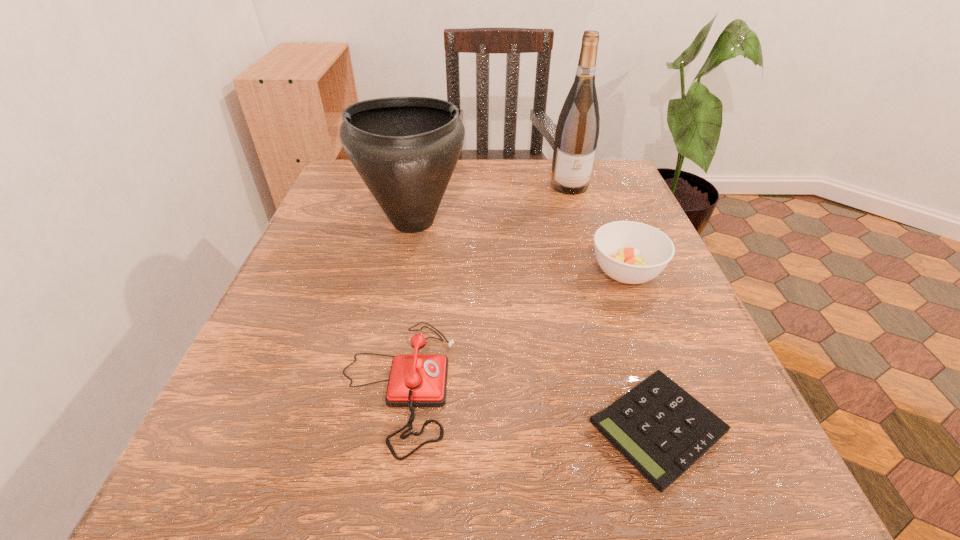
You are a GUI agent. You are given a task and a screenshot of the screen. Output one action in this format:
    pyautogui.click(x=<x>, y=<y>)
    Task: Click on the object that is positioned at the near left corner
    The image size is (960, 540).
    Given the screenshot: What is the action you would take?
    pyautogui.click(x=415, y=380)

Image resolution: width=960 pixels, height=540 pixels. I want to click on object at the far right corner, so click(x=577, y=131).

Image resolution: width=960 pixels, height=540 pixels. Identify the location of object that is at the near right corner. (662, 430).

Locate an element on the screen. free point at the far edge is located at coordinates (483, 205).

At what (x,y) coordinates should I click in order to perform the action: click on vacant space at the near edge of the desktop. Please return your answer as a coordinate pair (x, y). The image size is (960, 540). Looking at the image, I should click on 366,455.

This screenshot has height=540, width=960. In the image, there is a desktop. What are the coordinates of `vacant space at the left edge` in the screenshot? It's located at (370, 221).

The image size is (960, 540). Find the location of `free space at the right edge`. free space at the right edge is located at coordinates (625, 319).

This screenshot has height=540, width=960. What are the coordinates of `vacant point at the far left corner` in the screenshot? It's located at (332, 207).

What are the coordinates of `free space at the far right corner of the desktop` in the screenshot? It's located at (583, 207).

This screenshot has height=540, width=960. Find the location of `empty space that is in between the soup bowl and the telephone`. empty space that is in between the soup bowl and the telephone is located at coordinates (512, 328).